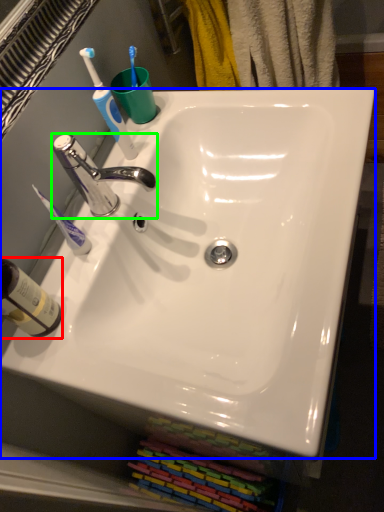
Question: Which object is the closest to the bottle (highlighted by a red box)? Choose among these: sink (highlighted by a blue box) or tap (highlighted by a green box).

Choices:
 (A) sink
 (B) tap

Answer: (B)